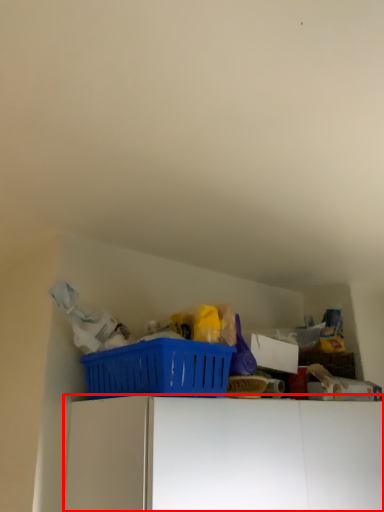
Question: Observing the image, what is the correct spatial positioning of furniture (annotated by the red box) in reference to basket?

Choices:
 (A) right
 (B) left

Answer: (A)